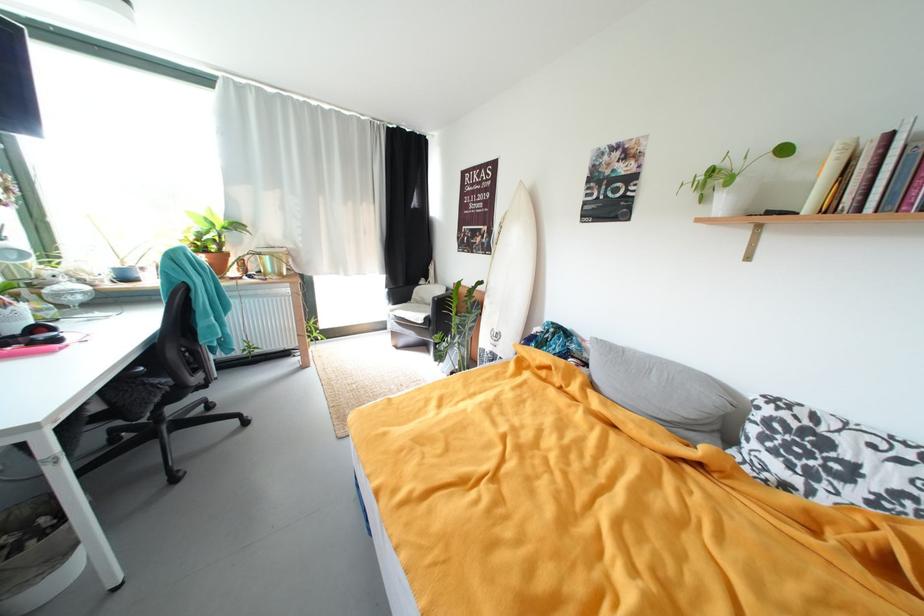
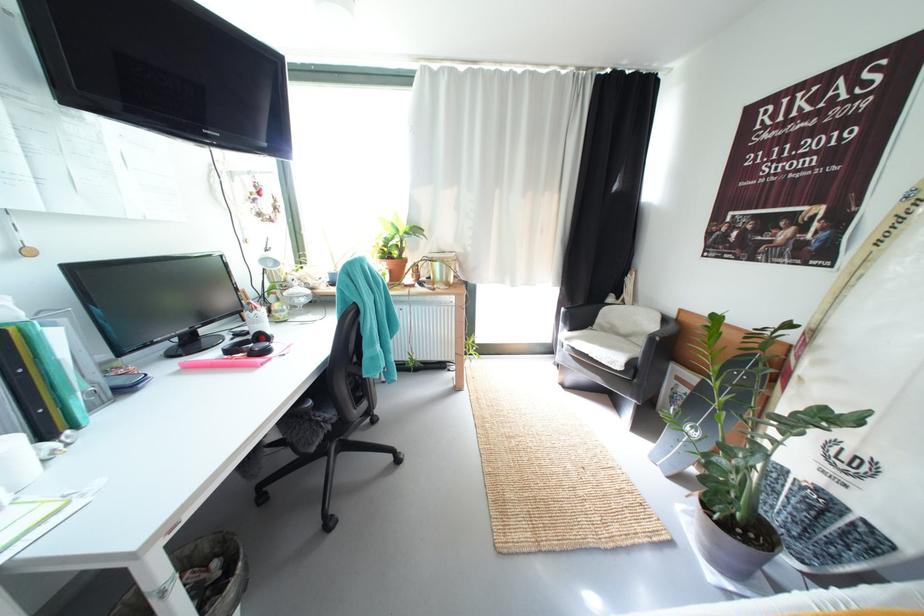
Question: The camera is either moving clockwise (left) or counter-clockwise (right) around the object. The first image is from the beginning of the video and the second image is from the end. Is the camera moving left or right when shooting the video?

Choices:
 (A) Left
 (B) Right

Answer: (B)